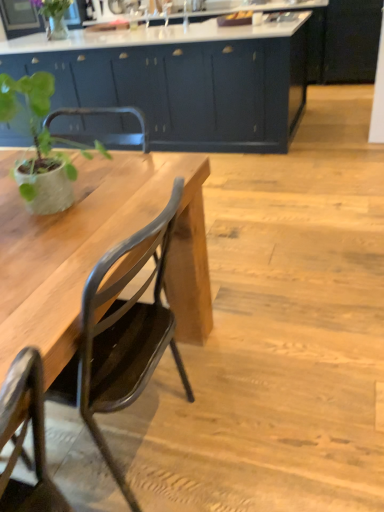
Question: Is the position of matte black chair at left less distant than that of green matte plant at left?

Choices:
 (A) no
 (B) yes

Answer: (B)

Question: Is matte black chair at left at the left side of green matte plant at left?

Choices:
 (A) no
 (B) yes

Answer: (A)

Question: Does matte black chair at left have a greater width compared to green matte plant at left?

Choices:
 (A) yes
 (B) no

Answer: (A)

Question: Is matte black chair at left next to green matte plant at left and touching it?

Choices:
 (A) no
 (B) yes

Answer: (A)

Question: From a real-world perspective, is matte black chair at left located higher than green matte plant at left?

Choices:
 (A) yes
 (B) no

Answer: (B)

Question: Is matte dark blue cabinets at center wider or thinner than green matte vase at upper left?

Choices:
 (A) wide
 (B) thin

Answer: (A)

Question: Is matte dark blue cabinets at center situated inside green matte vase at upper left or outside?

Choices:
 (A) inside
 (B) outside

Answer: (B)

Question: From a real-world perspective, relative to green matte vase at upper left, is matte dark blue cabinets at center vertically above or below?

Choices:
 (A) above
 (B) below

Answer: (B)

Question: Considering the positions of point (276, 39) and point (56, 20), is point (276, 39) closer or farther from the camera than point (56, 20)?

Choices:
 (A) farther
 (B) closer

Answer: (B)

Question: Considering the relative positions of green matte vase at upper left and green matte plant at left in the image provided, is green matte vase at upper left to the left or to the right of green matte plant at left?

Choices:
 (A) left
 (B) right

Answer: (A)

Question: In terms of width, does green matte vase at upper left look wider or thinner when compared to green matte plant at left?

Choices:
 (A) wide
 (B) thin

Answer: (A)

Question: From the image's perspective, is green matte vase at upper left above or below green matte plant at left?

Choices:
 (A) below
 (B) above

Answer: (B)

Question: Relative to green matte plant at left, is green matte vase at upper left in front or behind?

Choices:
 (A) front
 (B) behind

Answer: (B)

Question: In terms of height, does green matte plant at left look taller or shorter compared to green matte vase at upper left?

Choices:
 (A) tall
 (B) short

Answer: (A)

Question: In terms of width, does green matte plant at left look wider or thinner when compared to green matte vase at upper left?

Choices:
 (A) thin
 (B) wide

Answer: (A)